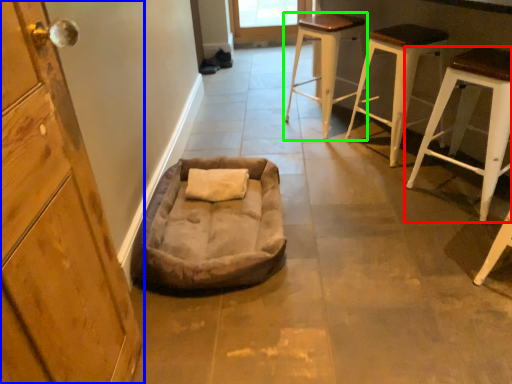
Question: Which object is the farthest from stool (highlighted by a red box)? Choose among these: cabinetry (highlighted by a blue box) or stool (highlighted by a green box).

Choices:
 (A) cabinetry
 (B) stool

Answer: (A)